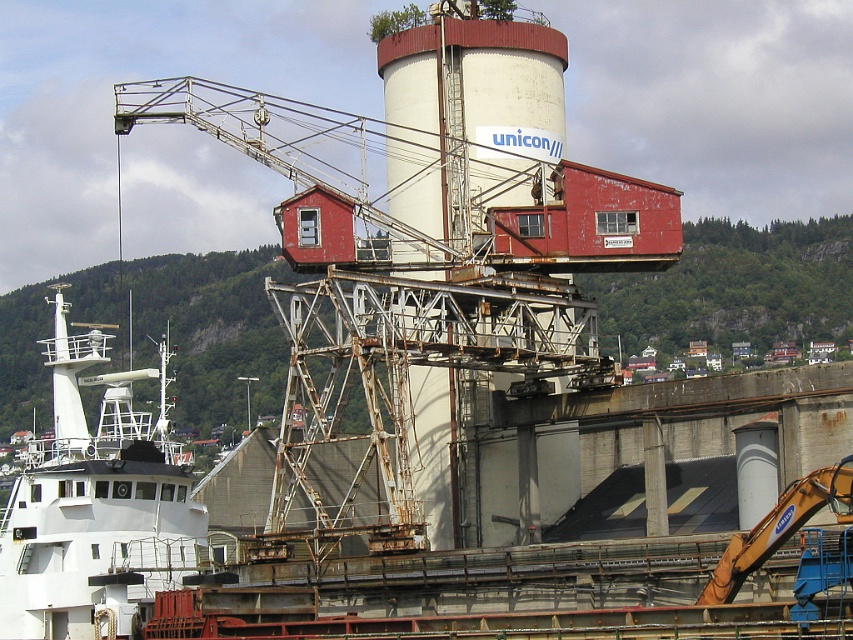
Based on the coordinates provided in the description, where is the white matte tower at center located in the image?

The white matte tower at center is located at point coordinates of (469, 109).

You are an engineer inspecting the industrial area and need to determine which structure has a narrower width between the white matte tower at center and the white matte boat at lower left.

The white matte tower at center is thinner than the white matte boat at lower left, so the white matte tower at center has a narrower width.

You are standing on the deck of the white matte boat at lower left and want to reach the white matte tower at center. Which direction should you move to get closer to the tower?

The white matte tower at center is positioned over the white matte boat at lower left, so you should move upward to reach it.